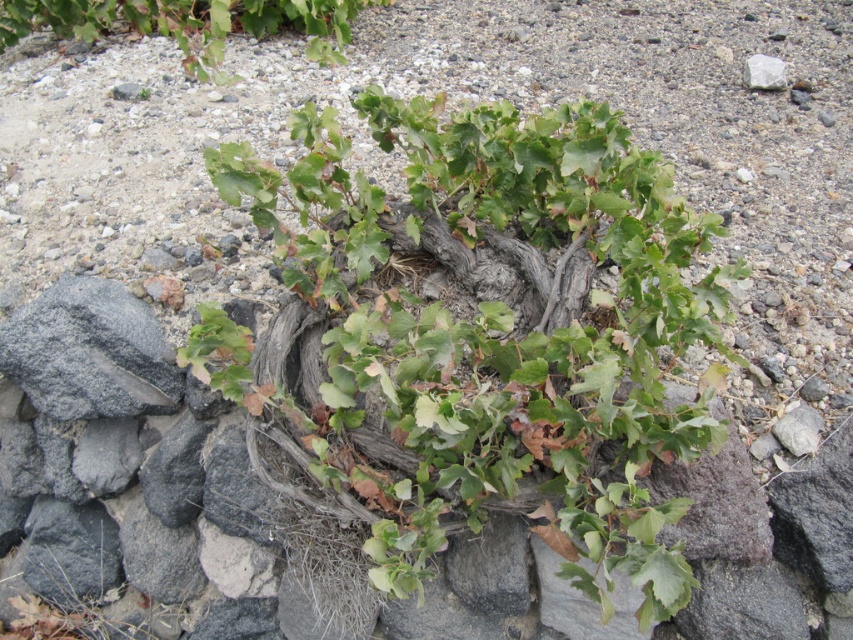
From the picture: Is green leafy plant at center closer to camera compared to green leafy plant at upper center?

Yes, green leafy plant at center is in front of green leafy plant at upper center.

Who is positioned more to the left, green leafy plant at center or green leafy plant at upper center?

Positioned to the left is green leafy plant at upper center.

Is point (279, 196) positioned after point (231, 12)?

No, it is not.

Find the location of a particular element. green leafy plant at center is located at coordinates (491, 332).

Can you confirm if green leafy plant at upper center is bigger than white smooth rock at upper right?

Yes.

Between green leafy plant at upper center and white smooth rock at upper right, which one is positioned lower?

white smooth rock at upper right is below.

Between point (318, 29) and point (781, 60), which one is positioned in front?

Point (781, 60)

Where is `green leafy plant at upper center`? green leafy plant at upper center is located at coordinates (189, 22).

Is green leafy plant at center to the right of white smooth rock at upper right from the viewer's perspective?

In fact, green leafy plant at center is to the left of white smooth rock at upper right.

Between point (653, 384) and point (779, 72), which one is positioned behind?

Positioned behind is point (779, 72).

Image resolution: width=853 pixels, height=640 pixels. I want to click on green leafy plant at center, so click(491, 332).

At what (x,y) coordinates should I click in order to perform the action: click on green leafy plant at center. Please return your answer as a coordinate pair (x, y). The width and height of the screenshot is (853, 640). Looking at the image, I should click on (491, 332).